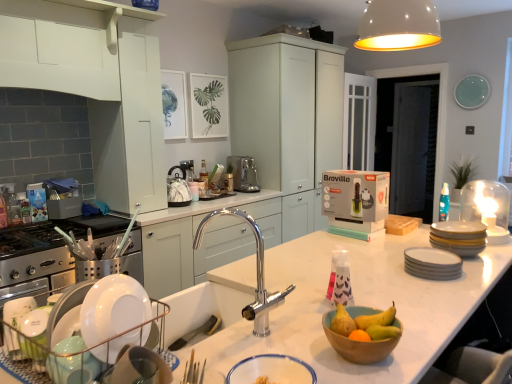
Locate an element on the screen. free space above white matte plates at right (from a real-world perspective) is located at coordinates (430, 251).